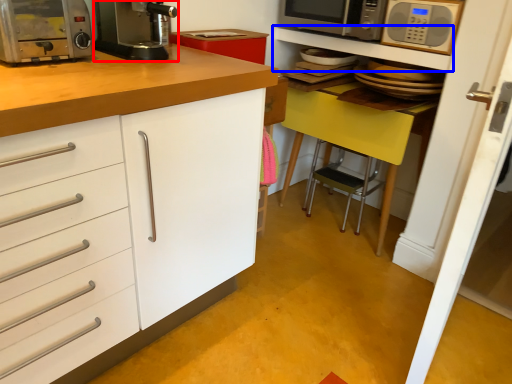
Question: Which object appears closest to the camera in this image, kitchen appliance (highlighted by a red box) or shelf (highlighted by a blue box)?

Choices:
 (A) kitchen appliance
 (B) shelf

Answer: (A)